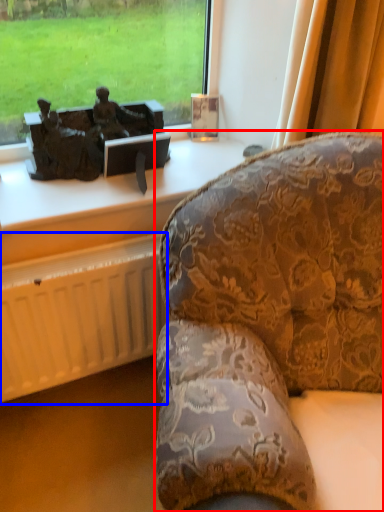
Question: Which point is closer to the camera, studio couch (highlighted by a red box) or radiator (highlighted by a blue box)?

Choices:
 (A) studio couch
 (B) radiator

Answer: (A)